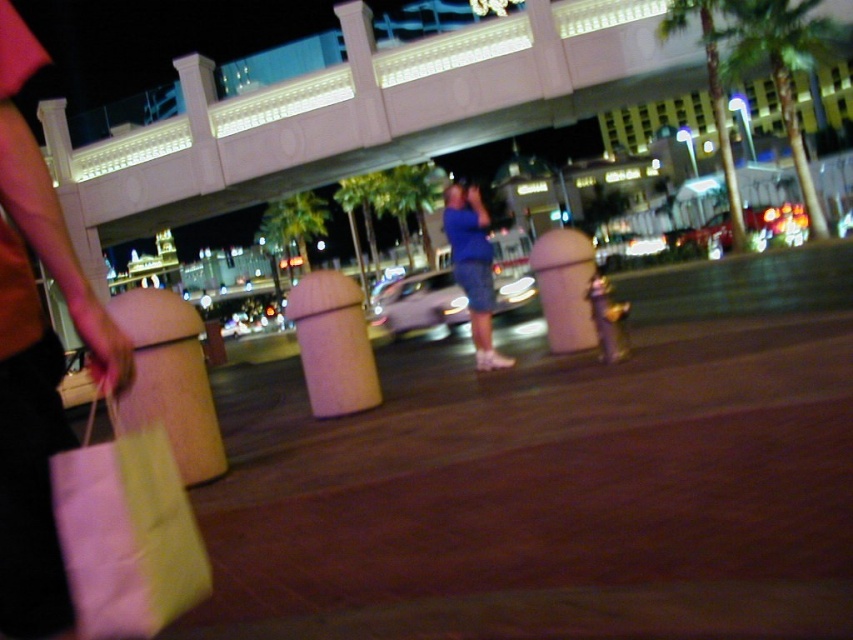
You are navigating an urban area at night and need to reach a destination straight ahead. There is a brown smooth pavement at center in your path. Can you walk directly over it?

The brown smooth pavement at center is located at point (550, 500), so yes, you can walk directly over it as it is part of the path ahead.

You are a delivery robot with a width of 1.8 meters. You need to move from the brown smooth pavement at center to the beige cylindrical trash bins in the midground. Can you fit through the space between them?

The space between the brown smooth pavement at center and the beige cylindrical trash bins in the midground is 1.94 meters. Since the robot is 1.8 meters wide, it can fit through the space as there is enough width available.

You are standing on the brown smooth pavement at center. A friend is holding a yellow shopping bag and is on the left side of the frame. Can you see your friend holding the yellow shopping bag from your current position?

Yes, because the friend holding the yellow shopping bag is on the left side of the frame, which is visible from the brown smooth pavement at center.